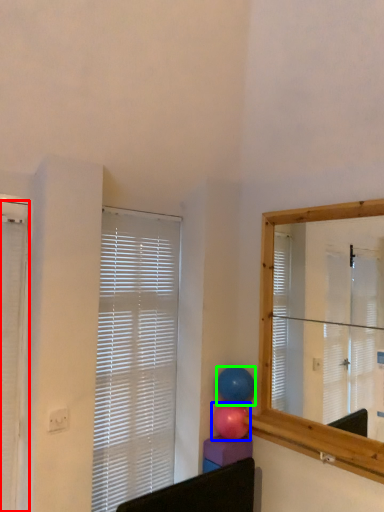
Question: Which object is positioned closest to window blind (highlighted by a red box)? Select from balloon (highlighted by a blue box) and balloon (highlighted by a green box).

Choices:
 (A) balloon
 (B) balloon

Answer: (A)